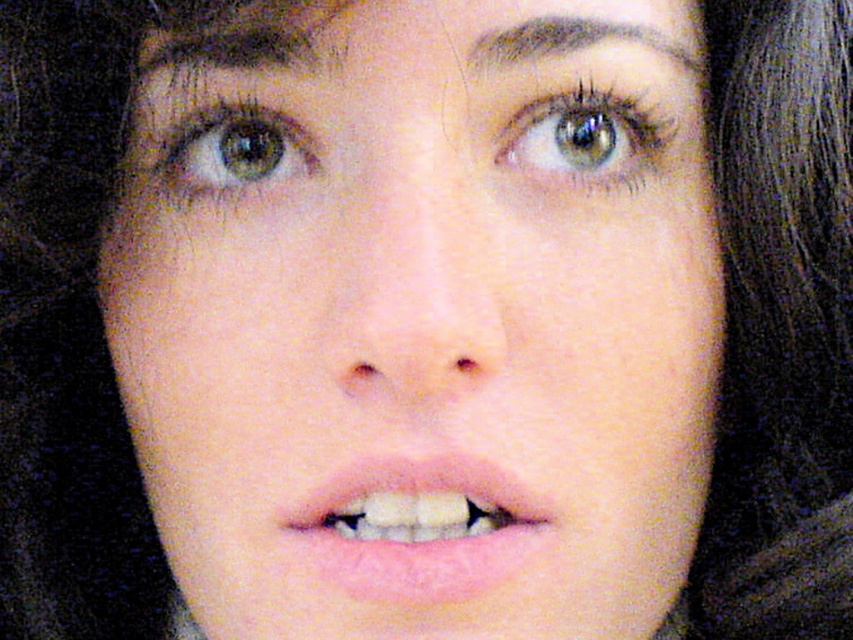
You are a photographer adjusting the lighting for a portrait. You notice the brown hair at upper center and the green matte eye at upper left in the frame. Which object is positioned more to the right side of the image?

The brown hair at upper center is positioned more to the right side of the image compared to the green matte eye at upper left, as it is located to the right of it.

You are a makeup artist trying to apply lipstick precisely. The image shows a person with pink matte lips at center. Where exactly should you apply the lipstick?

The pink matte lips at center are located at point (419, 528), so you should apply the lipstick there.